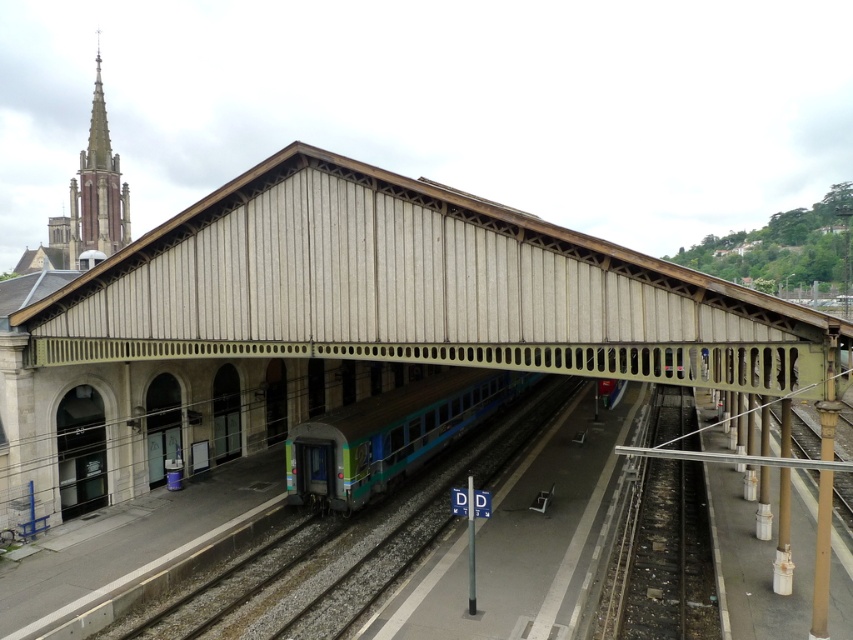
Between smooth concrete train track at lower right and teal glossy train at center, which one is positioned lower?

smooth concrete train track at lower right

Can you confirm if smooth concrete train track at lower right is positioned below teal glossy train at center?

Yes.

Consider the image. Who is more distant from viewer, (672, 595) or (370, 481)?

The point (370, 481) is behind.

Find the location of a particular element. smooth concrete train track at lower right is located at coordinates (660, 557).